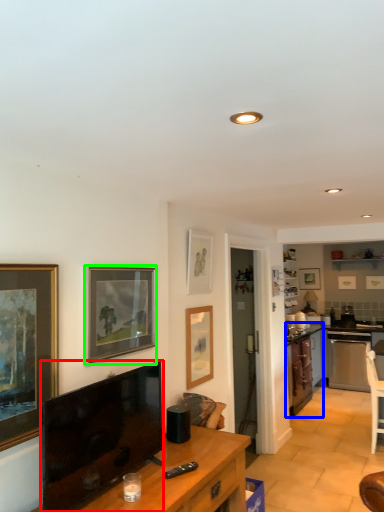
Question: Which object is positioned farthest from television (highlighted by a red box)? Select from cabinetry (highlighted by a blue box) and picture frame (highlighted by a green box).

Choices:
 (A) cabinetry
 (B) picture frame

Answer: (A)